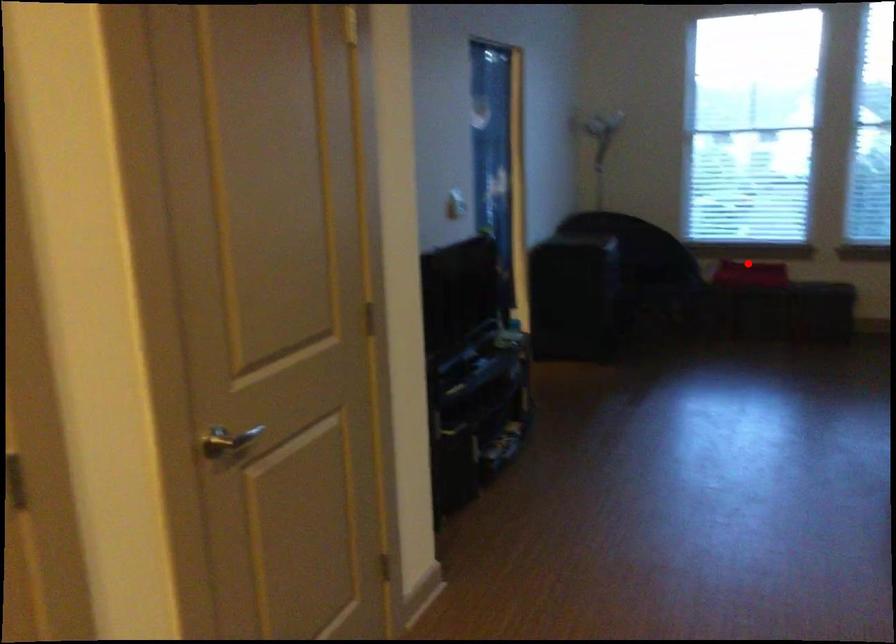
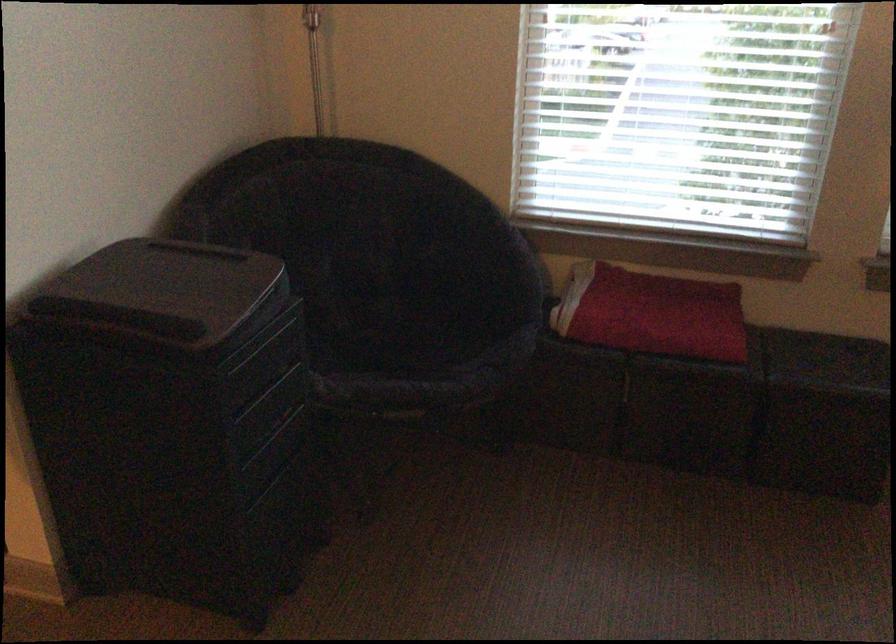
Locate, in the second image, the point that corresponds to the highlighted location in the first image.

(651, 313)